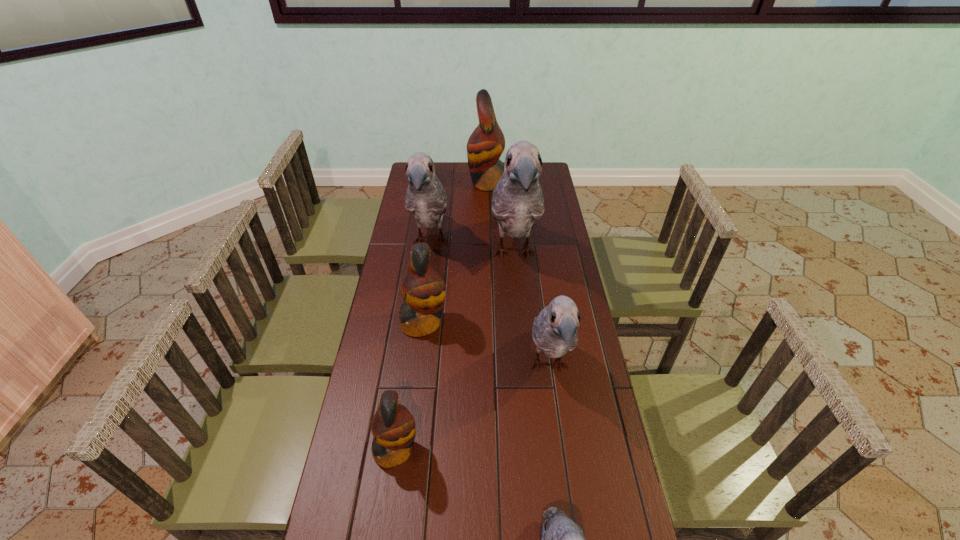
Select which gray parrot appears as the third closest to the biggest gray parrot. Please provide its 2D coordinates. Your answer should be formatted as a tuple, i.e. [(x, y)], where the tuple contains the x and y coordinates of a point satisfying the conditions above.

[(562, 539)]

Where is `gray parrot that is the third closest to the third smallest gray parrot`? The width and height of the screenshot is (960, 540). gray parrot that is the third closest to the third smallest gray parrot is located at coordinates (562, 539).

Identify the location of red parrot that is the closest one to the tallest object. (423, 289).

Image resolution: width=960 pixels, height=540 pixels. What are the coordinates of `red parrot that is the closest to the biggest gray parrot` in the screenshot? It's located at (423, 289).